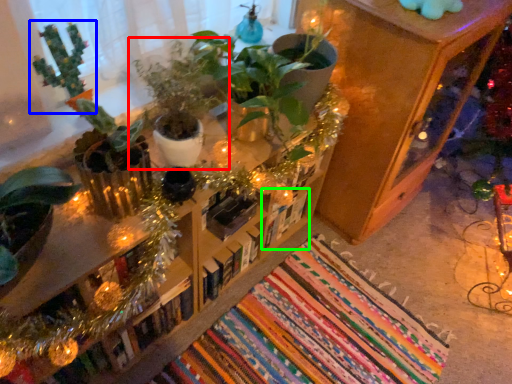
Question: Which object is positioned closest to houseplant (highlighted by a red box)? Select from houseplant (highlighted by a blue box) and book (highlighted by a green box).

Choices:
 (A) houseplant
 (B) book

Answer: (A)